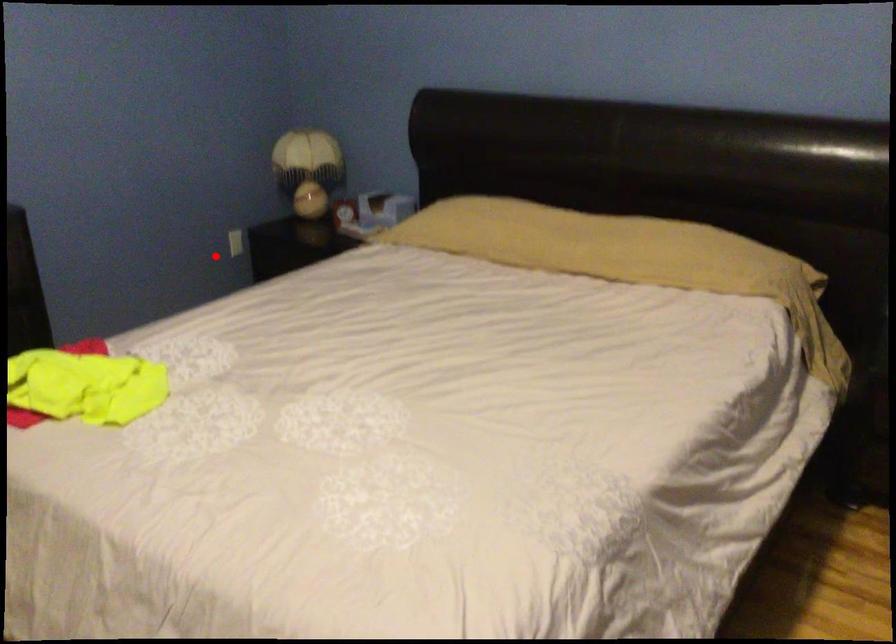
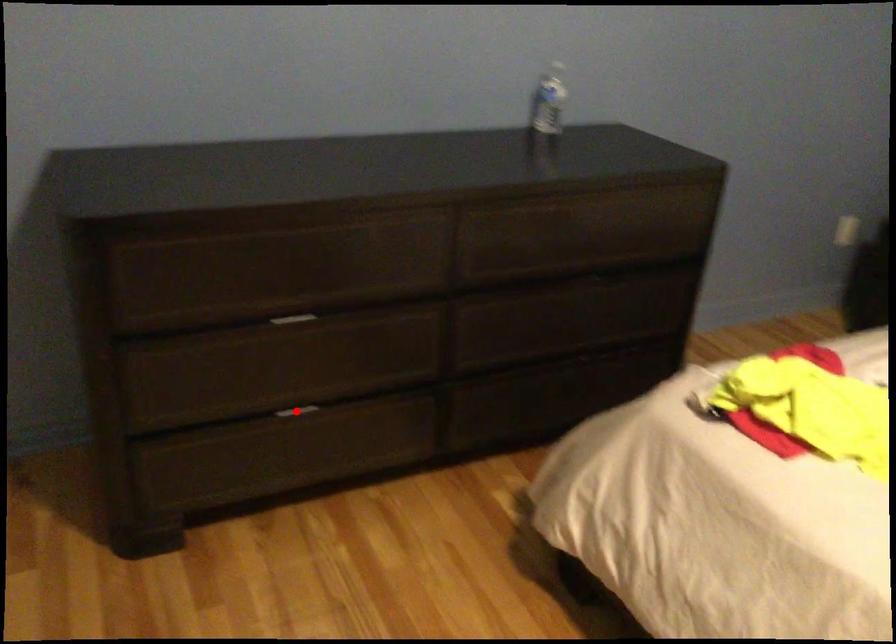
I am providing you with two images of the same scene from different viewpoints. A red point is marked on the first image and another point is marked on the second image. Do the highlighted points in image1 and image2 indicate the same real-world spot?

No